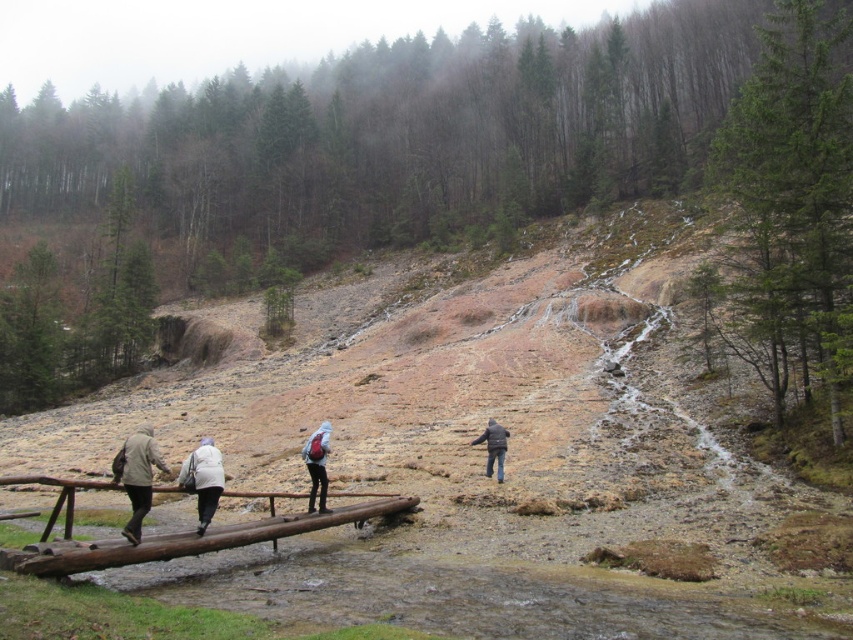
You are one of the hikers on the wooden bridge and notice both the matte black backpack at center and the dark brown leather jacket at center. Which item is placed higher on your body?

The matte black backpack at center is positioned over the dark brown leather jacket at center, so the matte black backpack at center is higher on your body.

You are one of the hikers on the wooden bridge and you want to place both the white woolen jacket at center and the matte black backpack at center into your pack. Which item should you put first to ensure the smaller one fits inside?

The matte black backpack at center is smaller than the white woolen jacket at center, so you should place the matte black backpack at center first to allow the larger jacket to fit over it.